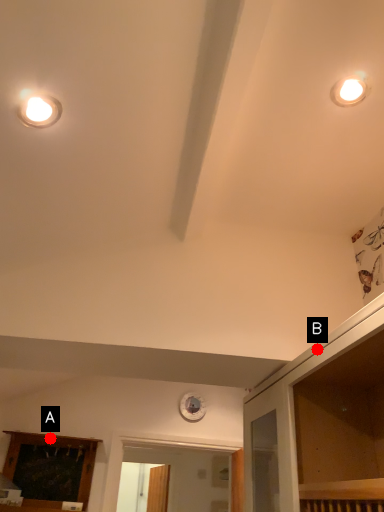
Question: Two points are circled on the image, labeled by A and B beside each circle. Which point is farther from the camera taking this photo?

Choices:
 (A) A is further
 (B) B is further

Answer: (A)